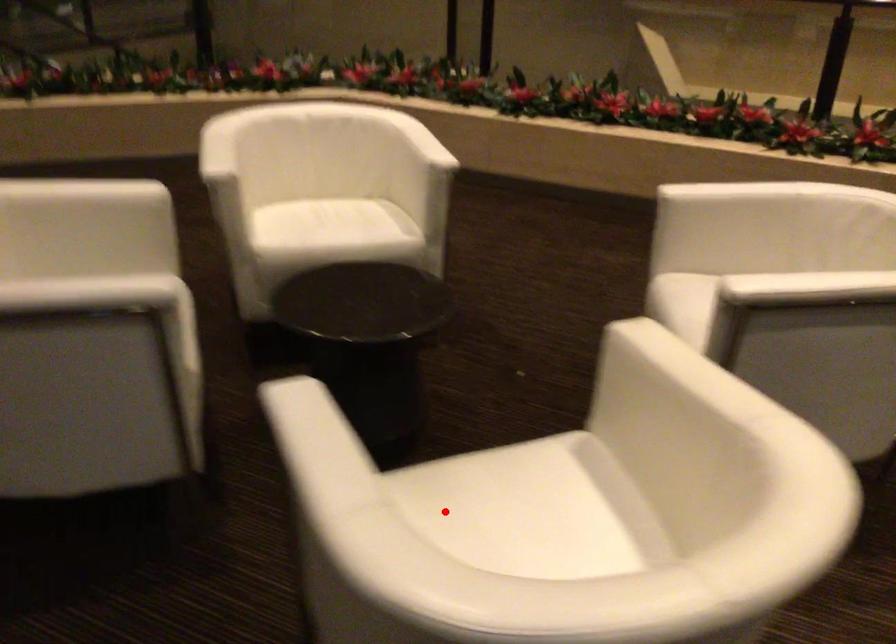
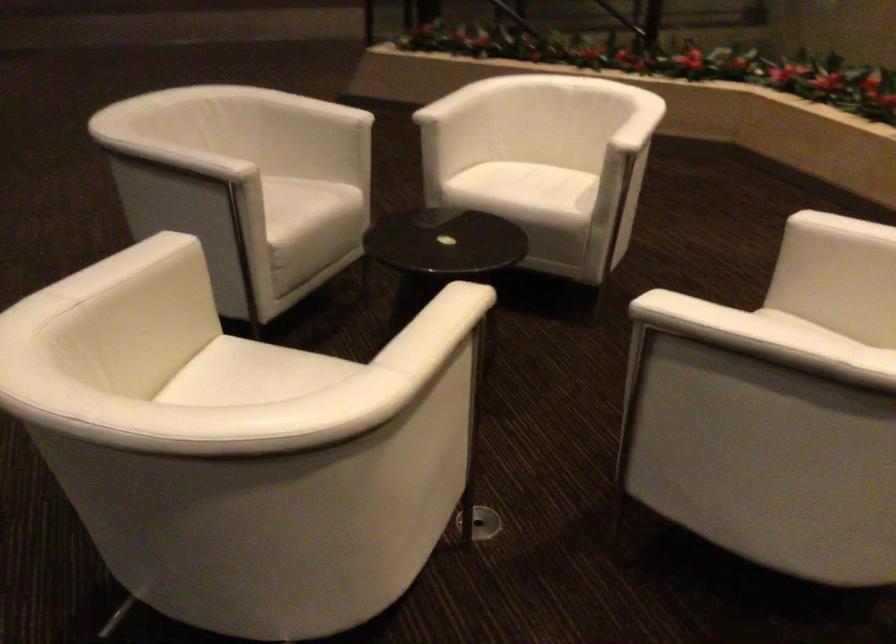
Locate, in the second image, the point that corresponds to the highlighted location in the first image.

(252, 375)